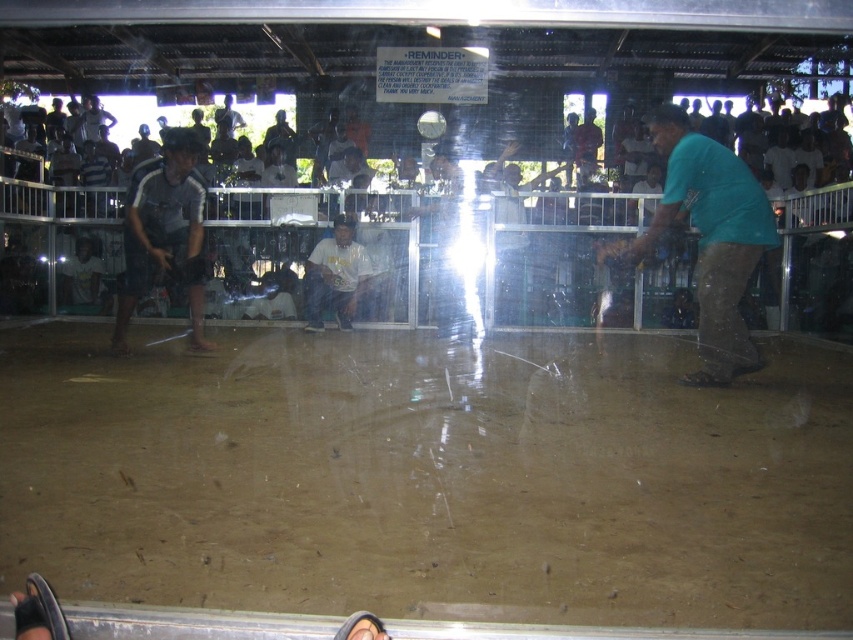
Is point (851, 228) positioned before point (708, 266)?

No, (851, 228) is further to viewer.

Between point (665, 312) and point (738, 202), which one is positioned behind?

Point (665, 312)

Is point (583, 304) farther from viewer compared to point (721, 220)?

Yes, point (583, 304) is farther from viewer.

Where is `white fabric crowd at upper center`? The height and width of the screenshot is (640, 853). white fabric crowd at upper center is located at coordinates (457, 250).

Who is positioned more to the left, white fabric crowd at upper center or brown leather sandal at lower center?

white fabric crowd at upper center

Is white fabric crowd at upper center smaller than brown leather sandal at lower center?

No.

Does point (532, 252) come behind point (728, 376)?

Yes, it is.

In order to click on white fabric crowd at upper center in this screenshot , I will do `click(457, 250)`.

Does white matte shirt at center appear on the left side of brown leather sandal at lower center?

Yes, white matte shirt at center is to the left of brown leather sandal at lower center.

Which of these two, white matte shirt at center or brown leather sandal at lower center, stands shorter?

Standing shorter between the two is brown leather sandal at lower center.

Who is more distant from viewer, (x=314, y=269) or (x=706, y=381)?

The point (x=314, y=269) is behind.

You are a GUI agent. You are given a task and a screenshot of the screen. Output one action in this format:
    pyautogui.click(x=<x>, y=<y>)
    Task: Click on the white matte shirt at center
    
    Given the screenshot: What is the action you would take?
    pyautogui.click(x=335, y=275)